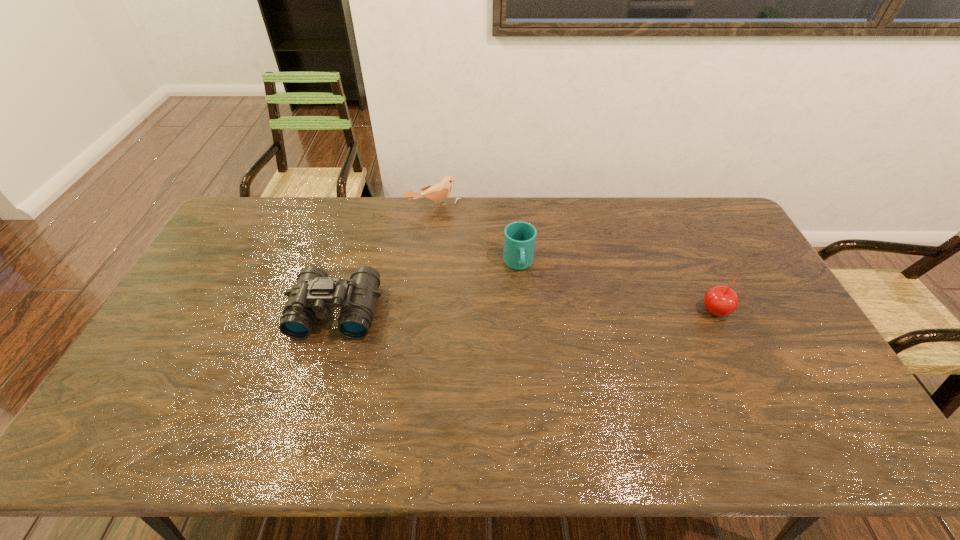
Where is `vacant point located 0.120m on the handle side of the cup`? vacant point located 0.120m on the handle side of the cup is located at coordinates (526, 307).

Image resolution: width=960 pixels, height=540 pixels. What are the coordinates of `vacant space located 0.160m at the beak of the bird` in the screenshot? It's located at [461, 241].

This screenshot has width=960, height=540. Identify the location of vacant space located 0.330m at the beak of the bird. (481, 273).

This screenshot has width=960, height=540. In order to click on free spot located 0.130m at the beak of the bird in this screenshot , I will do `click(457, 236)`.

Where is `object that is positioned at the far edge`? The image size is (960, 540). object that is positioned at the far edge is located at coordinates (437, 193).

This screenshot has width=960, height=540. Find the location of `free spot at the far edge of the desktop`. free spot at the far edge of the desktop is located at coordinates (300, 230).

In order to click on vacant space at the near edge of the desktop in this screenshot , I will do `click(378, 397)`.

Where is `vacant region at the left edge`? This screenshot has width=960, height=540. vacant region at the left edge is located at coordinates (192, 368).

Where is `free region at the near left corner of the desktop`? This screenshot has width=960, height=540. free region at the near left corner of the desktop is located at coordinates (132, 399).

Image resolution: width=960 pixels, height=540 pixels. Identify the location of vacant space at the far right corner of the desktop. (720, 227).